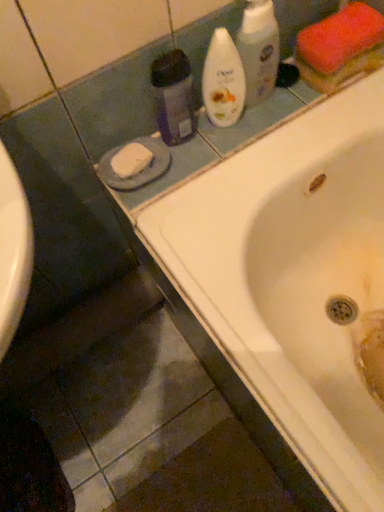
Identify the location of vacant area located to the right-hand side of white glossy bottle at upper center, marked as the 2th cleaning product in a right-to-left arrangement. (271, 116).